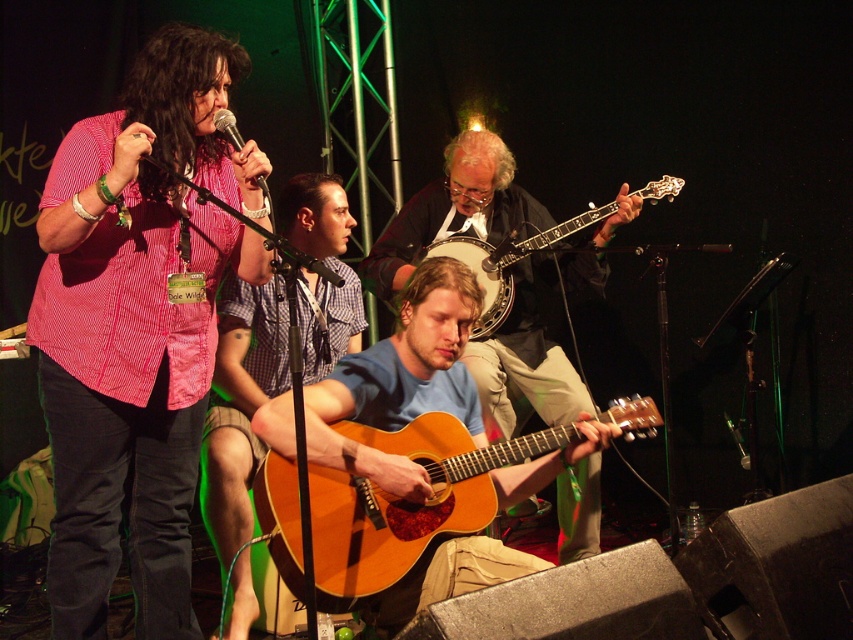
Question: Which of the following is the closest to the observer?

Choices:
 (A) matte black microphone at upper center
 (B) matte pink shirt at center

Answer: (B)

Question: Observing the image, what is the correct spatial positioning of light brown wood acoustic guitar at center in reference to checkered fabric shirt at center?

Choices:
 (A) below
 (B) above

Answer: (A)

Question: Can you confirm if light brown acoustic guitar at center is wider than metallic silver microphone at center?

Choices:
 (A) yes
 (B) no

Answer: (A)

Question: Which of the following is the closest to the observer?

Choices:
 (A) (531, 376)
 (B) (466, 440)
 (C) (115, 285)
 (D) (277, 262)

Answer: (D)

Question: Can you confirm if light brown acoustic guitar at center is positioned to the left of light brown wood acoustic guitar at center?

Choices:
 (A) no
 (B) yes

Answer: (A)

Question: Among these points, which one is nearest to the camera?

Choices:
 (A) pyautogui.click(x=233, y=145)
 (B) pyautogui.click(x=297, y=282)

Answer: (A)